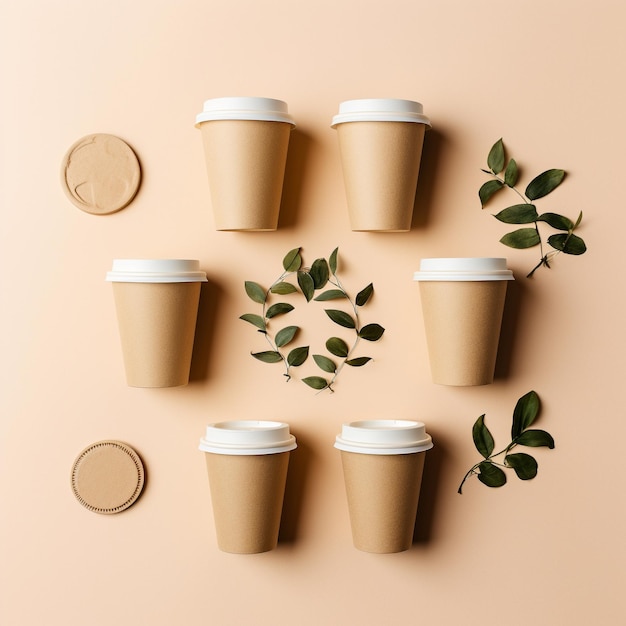
I want to click on cups with a lid, so click(x=272, y=511), click(x=416, y=498), click(x=456, y=342), click(x=374, y=196), click(x=269, y=203), click(x=173, y=372).